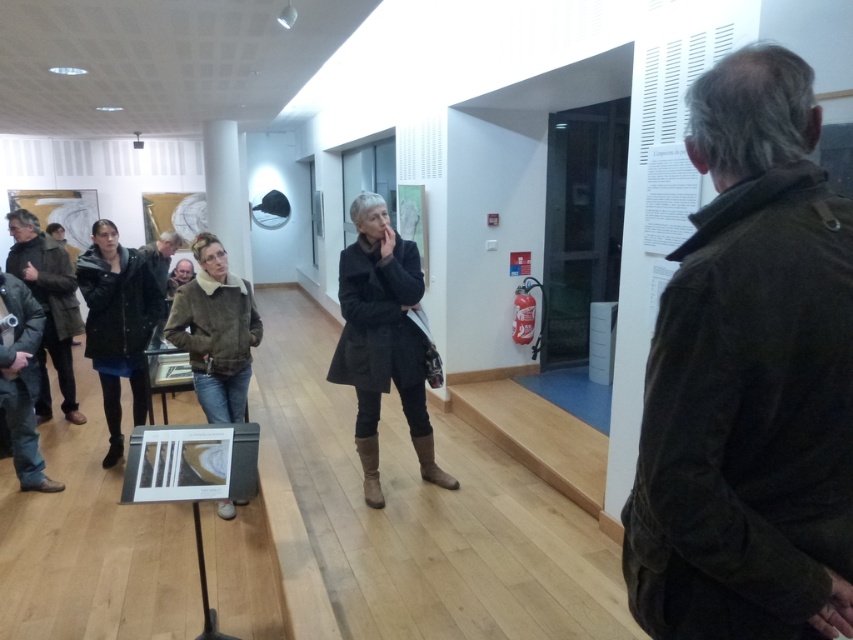
Question: Can you confirm if dark gray wool coat at center is positioned to the right of brown suede jacket at center?

Choices:
 (A) yes
 (B) no

Answer: (A)

Question: Which of these objects is positioned farthest from the dark brown corduroy jacket at upper right?

Choices:
 (A) dark brown leather jacket at left
 (B) dark gray wool coat at center
 (C) brown suede jacket at center

Answer: (A)

Question: Which of the following is the closest to the observer?

Choices:
 (A) dark brown leather jacket at left
 (B) brown suede jacket at center
 (C) dark brown corduroy jacket at upper right

Answer: (C)

Question: Is dark brown corduroy jacket at upper right thinner than dark gray wool coat at center?

Choices:
 (A) no
 (B) yes

Answer: (B)

Question: Considering the real-world distances, which object is closest to the dark brown leather jacket at left?

Choices:
 (A) dark brown corduroy jacket at upper right
 (B) brown suede jacket at center
 (C) dark gray wool coat at center

Answer: (B)

Question: Is dark brown corduroy jacket at upper right thinner than brown suede jacket at center?

Choices:
 (A) no
 (B) yes

Answer: (B)